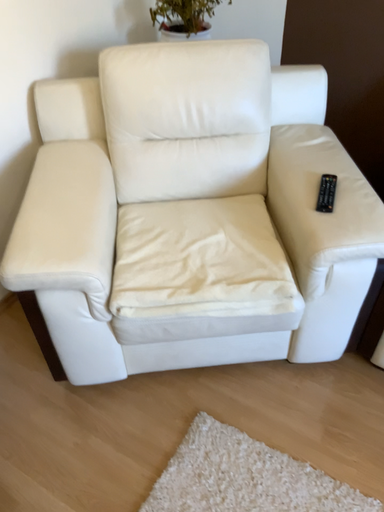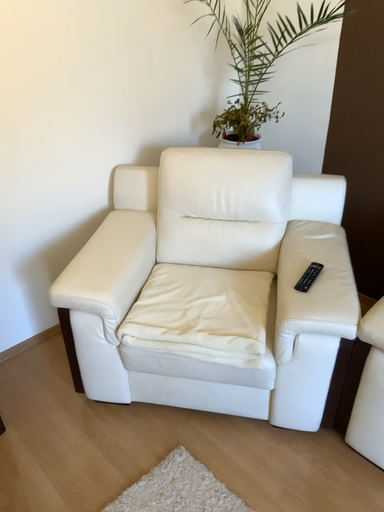
Question: How did the camera likely rotate when shooting the video?

Choices:
 (A) rotated downward
 (B) rotated upward

Answer: (B)